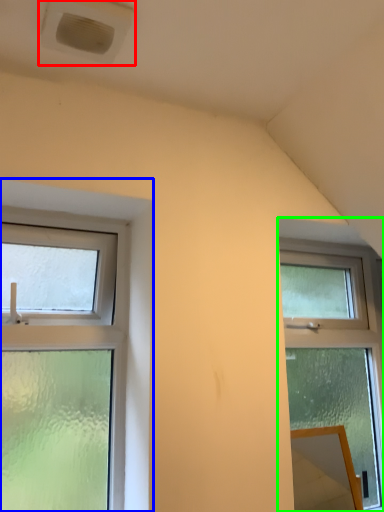
Question: Estimate the real-world distances between objects in this image. Which object is closer to air conditioning (highlighted by a red box), window (highlighted by a blue box) or window (highlighted by a green box)?

Choices:
 (A) window
 (B) window

Answer: (A)